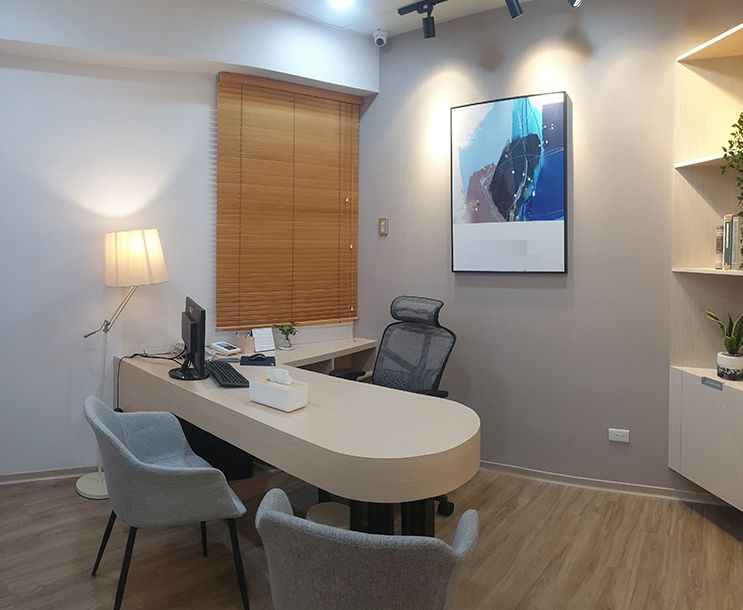
Find the location of `lampshade`. lampshade is located at coordinates (140, 252).